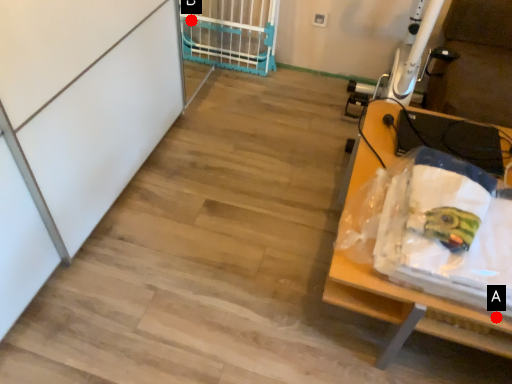
Question: Two points are circled on the image, labeled by A and B beside each circle. Which point is farther to the camera?

Choices:
 (A) A is further
 (B) B is further

Answer: (B)